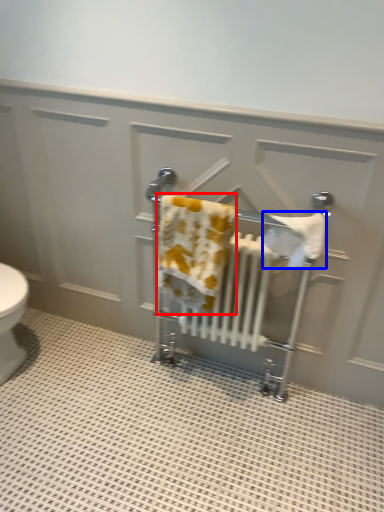
Question: Which point is further to the camera, bath towel (highlighted by a red box) or bath towel (highlighted by a blue box)?

Choices:
 (A) bath towel
 (B) bath towel

Answer: (A)